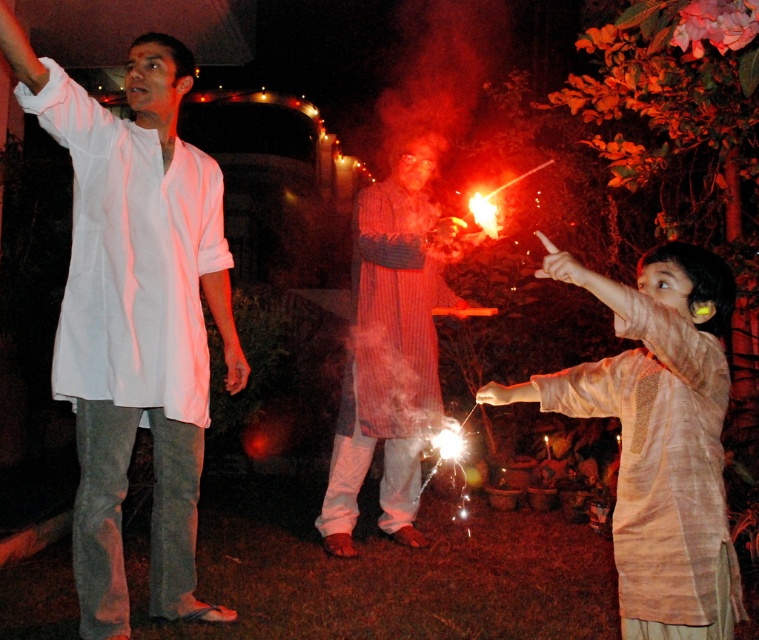
In the nighttime scene with fireworks, there are three people. One is a man in a white kurta and gray pants on the left, another is holding a sparkler in the center, and the third is at point (657, 435). What is the third person wearing?

The third person at point (657, 435) is wearing a matte beige kurta at right.

You are at a fireworks display and want to take a photo of the white cotton shirt at upper left and the striped cotton robe at center. Which one should you focus on first to ensure both are in the frame?

The white cotton shirt at upper left is positioned on the left side of striped cotton robe at center, so you should focus on the white cotton shirt at upper left first to ensure both are in the frame.

You are organizing a costume party and need to determine which outfit takes up more space in the closet. Based on the image, which of the two outfits, the matte beige kurta at right or the striped cotton robe at center, requires more storage space?

The striped cotton robe at center occupies more space than the matte beige kurta at right, so it requires more storage space.